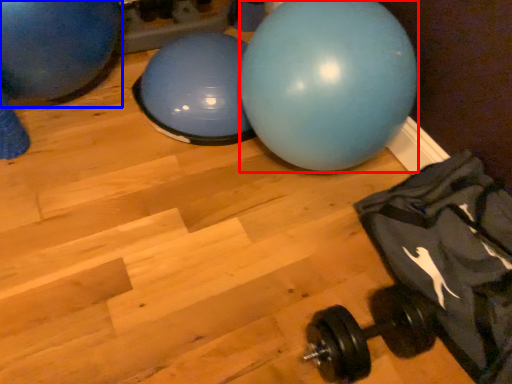
Question: Which object is further to the camera taking this photo, ball (highlighted by a red box) or ball (highlighted by a blue box)?

Choices:
 (A) ball
 (B) ball

Answer: (B)